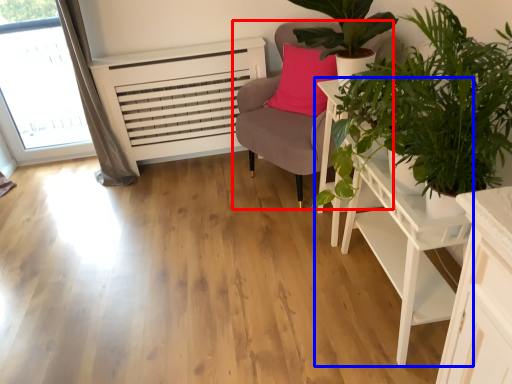
Question: Among these objects, which one is nearest to the camera, chair (highlighted by a red box) or table (highlighted by a blue box)?

Choices:
 (A) chair
 (B) table

Answer: (B)